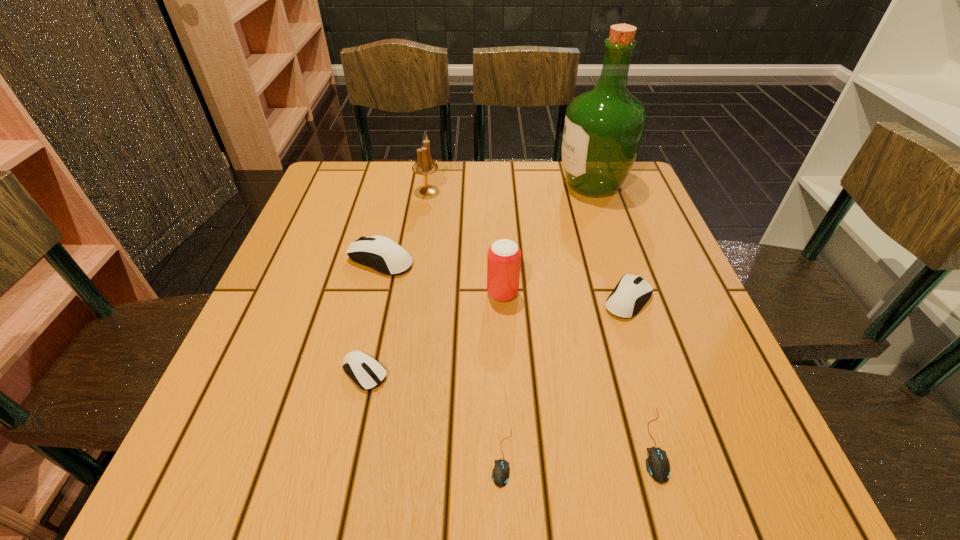
The width and height of the screenshot is (960, 540). Find the location of `free location located on the back of the farthest mouse`. free location located on the back of the farthest mouse is located at coordinates (392, 216).

Where is `free location located on the left of the rightmost white mouse`? This screenshot has width=960, height=540. free location located on the left of the rightmost white mouse is located at coordinates (430, 300).

Identify the location of free space located on the right of the sixth tallest object. This screenshot has width=960, height=540. (541, 372).

You are a GUI agent. You are given a task and a screenshot of the screen. Output one action in this format:
    pyautogui.click(x=<x>, y=<y>)
    Task: Click on the vacant space situated 0.340m on the back of the bigger black mouse
    The width and height of the screenshot is (960, 540).
    Given the screenshot: What is the action you would take?
    pyautogui.click(x=601, y=265)

The width and height of the screenshot is (960, 540). Find the location of `vacant space located on the back of the third mouse from right to left`. vacant space located on the back of the third mouse from right to left is located at coordinates (496, 293).

At what (x,y) coordinates should I click in order to perform the action: click on liquor that is at the far edge. Please return your answer as a coordinate pair (x, y). Looking at the image, I should click on (603, 130).

Identify the location of candle holder present at the far edge. The width and height of the screenshot is (960, 540). (425, 166).

Where is `object that is positioned at the left edge`? The width and height of the screenshot is (960, 540). object that is positioned at the left edge is located at coordinates (380, 253).

The width and height of the screenshot is (960, 540). What are the coordinates of `liquor that is at the right edge` in the screenshot? It's located at (603, 130).

Where is `object that is positioned at the far right corner`? The image size is (960, 540). object that is positioned at the far right corner is located at coordinates (603, 130).